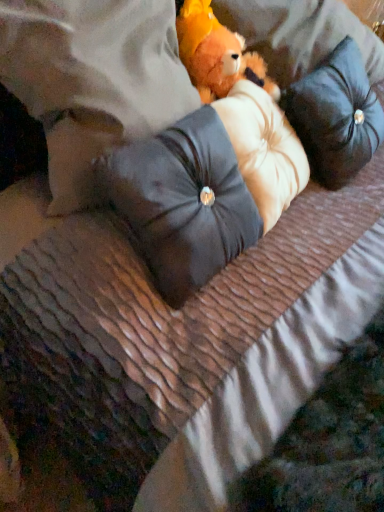
In order to click on leather-like pillow at center, the third pillow from the right in this screenshot , I will do `click(92, 80)`.

Locate an element on the screen. fluffy orange teddy bear at center is located at coordinates (216, 54).

Measure the distance between satin black pillow at center, which ranks as the second pillow in left-to-right order, and camera.

satin black pillow at center, which ranks as the second pillow in left-to-right order, is 26.00 inches away from camera.

Describe the element at coordinates (336, 116) in the screenshot. The image size is (384, 512). I see `black velvet pillow at upper right, the 3th pillow when ordered from left to right` at that location.

You are a GUI agent. You are given a task and a screenshot of the screen. Output one action in this format:
    pyautogui.click(x=<x>, y=<y>)
    Task: Click on the leather-like pillow at center, the third pillow from the right
    The width and height of the screenshot is (384, 512).
    Given the screenshot: What is the action you would take?
    pyautogui.click(x=92, y=80)

Between fluffy orange teddy bear at center and black velvet pillow at upper right, the 3th pillow when ordered from left to right, which one has larger width?

Wider between the two is black velvet pillow at upper right, the 3th pillow when ordered from left to right.

Based on the photo, does fluffy orange teddy bear at center have a greater height compared to black velvet pillow at upper right, placed as the 1th pillow when sorted from right to left?

Incorrect, the height of fluffy orange teddy bear at center is not larger of that of black velvet pillow at upper right, placed as the 1th pillow when sorted from right to left.

In order to click on teddy bear above the black velvet pillow at upper right, placed as the 1th pillow when sorted from right to left (from a real-world perspective) in this screenshot , I will do `click(216, 54)`.

How many degrees apart are the facing directions of satin black pillow at center, which ranks as the second pillow in left-to-right order, and leather-like pillow at center, which is counted as the first pillow, starting from the left?

2.7 degrees.

Considering the relative sizes of satin black pillow at center, which ranks as the second pillow in left-to-right order, and leather-like pillow at center, which is counted as the first pillow, starting from the left, in the image provided, is satin black pillow at center, which ranks as the second pillow in left-to-right order, wider than leather-like pillow at center, which is counted as the first pillow, starting from the left,?

Incorrect, the width of satin black pillow at center, which ranks as the second pillow in left-to-right order, does not surpass that of leather-like pillow at center, which is counted as the first pillow, starting from the left.

Between satin black pillow at center, the second pillow when ordered from right to left, and leather-like pillow at center, which is counted as the first pillow, starting from the left, which one appears on the right side from the viewer's perspective?

satin black pillow at center, the second pillow when ordered from right to left, is more to the right.

From a real-world perspective, is satin black pillow at center, which ranks as the second pillow in left-to-right order, physically located above or below leather-like pillow at center, the third pillow from the right?

In terms of real-world spatial position, satin black pillow at center, which ranks as the second pillow in left-to-right order, is below leather-like pillow at center, the third pillow from the right.

Is satin black pillow at center, which ranks as the second pillow in left-to-right order, taller or shorter than fluffy orange teddy bear at center?

In the image, satin black pillow at center, which ranks as the second pillow in left-to-right order, appears to be taller than fluffy orange teddy bear at center.

From the image's perspective, which is above, satin black pillow at center, which ranks as the second pillow in left-to-right order, or fluffy orange teddy bear at center?

fluffy orange teddy bear at center, from the image's perspective.

From the picture: Between satin black pillow at center, the second pillow when ordered from right to left, and fluffy orange teddy bear at center, which one appears on the right side from the viewer's perspective?

fluffy orange teddy bear at center is more to the right.

Is satin black pillow at center, the second pillow when ordered from right to left, behind fluffy orange teddy bear at center?

No, it is in front of fluffy orange teddy bear at center.

Considering the positions of objects leather-like pillow at center, which is counted as the first pillow, starting from the left, and black velvet pillow at upper right, the 3th pillow when ordered from left to right, in the image provided, who is more to the left, leather-like pillow at center, which is counted as the first pillow, starting from the left, or black velvet pillow at upper right, the 3th pillow when ordered from left to right,?

leather-like pillow at center, which is counted as the first pillow, starting from the left.

From the picture: Which object is thinner, leather-like pillow at center, which is counted as the first pillow, starting from the left, or black velvet pillow at upper right, the 3th pillow when ordered from left to right?

With smaller width is black velvet pillow at upper right, the 3th pillow when ordered from left to right.

In the scene shown: Considering their positions, is leather-like pillow at center, the third pillow from the right, located in front of or behind black velvet pillow at upper right, the 3th pillow when ordered from left to right?

leather-like pillow at center, the third pillow from the right, is in front of black velvet pillow at upper right, the 3th pillow when ordered from left to right.

Is leather-like pillow at center, which is counted as the first pillow, starting from the left, not inside black velvet pillow at upper right, the 3th pillow when ordered from left to right?

Yes.

Locate an element on the screen. The height and width of the screenshot is (512, 384). the 1st pillow below the leather-like pillow at center, which is counted as the first pillow, starting from the left (from a real-world perspective) is located at coordinates (183, 202).

Considering the points (149, 53) and (177, 180), which point is in front, point (149, 53) or point (177, 180)?

The point (177, 180) is closer to the camera.

Does leather-like pillow at center, which is counted as the first pillow, starting from the left, have a lesser width compared to satin black pillow at center, which ranks as the second pillow in left-to-right order?

Incorrect, the width of leather-like pillow at center, which is counted as the first pillow, starting from the left, is not less than that of satin black pillow at center, which ranks as the second pillow in left-to-right order.

Considering the positions of points (325, 120) and (48, 153), is point (325, 120) closer to camera compared to point (48, 153)?

No, it is behind (48, 153).

Is black velvet pillow at upper right, placed as the 1th pillow when sorted from right to left, looking in the opposite direction of leather-like pillow at center, the third pillow from the right?

No, black velvet pillow at upper right, placed as the 1th pillow when sorted from right to left, is not facing the opposite direction of leather-like pillow at center, the third pillow from the right.

From the image's perspective, would you say black velvet pillow at upper right, the 3th pillow when ordered from left to right, is shown under leather-like pillow at center, which is counted as the first pillow, starting from the left?

Yes, from the image's perspective, black velvet pillow at upper right, the 3th pillow when ordered from left to right, is below leather-like pillow at center, which is counted as the first pillow, starting from the left.

How different are the orientations of black velvet pillow at upper right, the 3th pillow when ordered from left to right, and leather-like pillow at center, the third pillow from the right, in degrees?

8.84 degrees.

Is satin black pillow at center, the second pillow when ordered from right to left, not close to black velvet pillow at upper right, the 3th pillow when ordered from left to right?

No, there isn't a large distance between satin black pillow at center, the second pillow when ordered from right to left, and black velvet pillow at upper right, the 3th pillow when ordered from left to right.

Where is `pillow behind the satin black pillow at center, the second pillow when ordered from right to left`? Image resolution: width=384 pixels, height=512 pixels. pillow behind the satin black pillow at center, the second pillow when ordered from right to left is located at coordinates (x=336, y=116).

Is satin black pillow at center, which ranks as the second pillow in left-to-right order, to the right of black velvet pillow at upper right, the 3th pillow when ordered from left to right, from the viewer's perspective?

In fact, satin black pillow at center, which ranks as the second pillow in left-to-right order, is to the left of black velvet pillow at upper right, the 3th pillow when ordered from left to right.

Where is `teddy bear behind the black velvet pillow at upper right, the 3th pillow when ordered from left to right`? The image size is (384, 512). teddy bear behind the black velvet pillow at upper right, the 3th pillow when ordered from left to right is located at coordinates (216, 54).

Image resolution: width=384 pixels, height=512 pixels. What are the coordinates of `pillow positioned vertically above the satin black pillow at center, which ranks as the second pillow in left-to-right order (from a real-world perspective)` in the screenshot? It's located at (92, 80).

Consider the image. When comparing their distances from satin black pillow at center, the second pillow when ordered from right to left, does black velvet pillow at upper right, placed as the 1th pillow when sorted from right to left, or leather-like pillow at center, which is counted as the first pillow, starting from the left, seem further?

Among the two, black velvet pillow at upper right, placed as the 1th pillow when sorted from right to left, is located further to satin black pillow at center, the second pillow when ordered from right to left.

From the image, which object appears to be farther from satin black pillow at center, the second pillow when ordered from right to left, leather-like pillow at center, the third pillow from the right, or black velvet pillow at upper right, the 3th pillow when ordered from left to right?

black velvet pillow at upper right, the 3th pillow when ordered from left to right.

Looking at the image, which one is located further to satin black pillow at center, the second pillow when ordered from right to left, black velvet pillow at upper right, the 3th pillow when ordered from left to right, or fluffy orange teddy bear at center?

Among the two, black velvet pillow at upper right, the 3th pillow when ordered from left to right, is located further to satin black pillow at center, the second pillow when ordered from right to left.

From the picture: Which object lies nearer to the anchor point fluffy orange teddy bear at center, satin black pillow at center, which ranks as the second pillow in left-to-right order, or black velvet pillow at upper right, the 3th pillow when ordered from left to right?

black velvet pillow at upper right, the 3th pillow when ordered from left to right, is positioned closer to the anchor fluffy orange teddy bear at center.

Considering their positions, is satin black pillow at center, the second pillow when ordered from right to left, positioned closer to fluffy orange teddy bear at center than leather-like pillow at center, the third pillow from the right?

leather-like pillow at center, the third pillow from the right, is positioned closer to the anchor fluffy orange teddy bear at center.

Considering their positions, is leather-like pillow at center, which is counted as the first pillow, starting from the left, positioned further to fluffy orange teddy bear at center than satin black pillow at center, which ranks as the second pillow in left-to-right order?

Based on the image, satin black pillow at center, which ranks as the second pillow in left-to-right order, appears to be further to fluffy orange teddy bear at center.

Estimate the real-world distances between objects in this image. Which object is further from leather-like pillow at center, which is counted as the first pillow, starting from the left, black velvet pillow at upper right, the 3th pillow when ordered from left to right, or fluffy orange teddy bear at center?

black velvet pillow at upper right, the 3th pillow when ordered from left to right, is further to leather-like pillow at center, which is counted as the first pillow, starting from the left.

Estimate the real-world distances between objects in this image. Which object is further from fluffy orange teddy bear at center, black velvet pillow at upper right, placed as the 1th pillow when sorted from right to left, or satin black pillow at center, the second pillow when ordered from right to left?

satin black pillow at center, the second pillow when ordered from right to left, is positioned further to the anchor fluffy orange teddy bear at center.

At what (x,y) coordinates should I click in order to perform the action: click on pillow situated between leather-like pillow at center, which is counted as the first pillow, starting from the left, and black velvet pillow at upper right, the 3th pillow when ordered from left to right, from left to right. Please return your answer as a coordinate pair (x, y). This screenshot has width=384, height=512. Looking at the image, I should click on (183, 202).

This screenshot has height=512, width=384. I want to click on teddy bear between leather-like pillow at center, the third pillow from the right, and black velvet pillow at upper right, the 3th pillow when ordered from left to right, from left to right, so click(x=216, y=54).